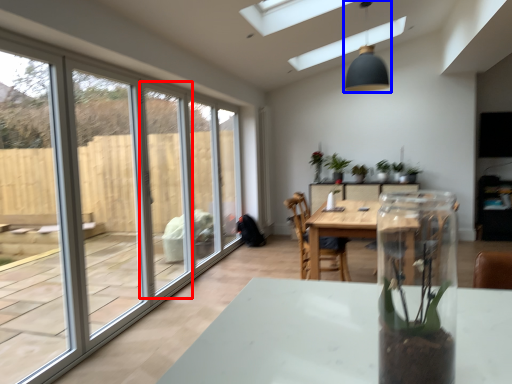
Question: Which object is further to the camera taking this photo, screen door (highlighted by a red box) or light fixture (highlighted by a blue box)?

Choices:
 (A) screen door
 (B) light fixture

Answer: (B)